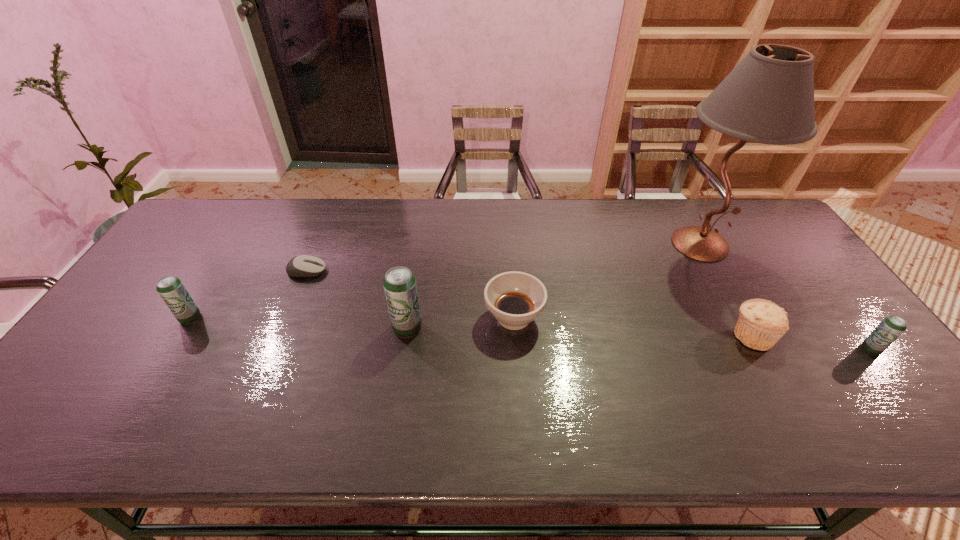
Identify which object is the third closest to the computer equipment. Please provide its 2D coordinates. Your answer should be formatted as a tuple, i.e. [(x, y)], where the tuple contains the x and y coordinates of a point satisfying the conditions above.

[(515, 299)]

Identify which beer can is the second nearest to the sixth shortest object. Please provide its 2D coordinates. Your answer should be formatted as a tuple, i.e. [(x, y)], where the tuple contains the x and y coordinates of a point satisfying the conditions above.

[(891, 327)]

Identify which beer can is the third closest to the muffin. Please provide its 2D coordinates. Your answer should be formatted as a tuple, i.e. [(x, y)], where the tuple contains the x and y coordinates of a point satisfying the conditions above.

[(170, 288)]

The height and width of the screenshot is (540, 960). I want to click on free space in the image that satisfies the following two spatial constraints: 1. on the wheel side of the shortest object; 2. on the right side of the rightmost beer can, so click(275, 349).

This screenshot has width=960, height=540. I want to click on free space that satisfies the following two spatial constraints: 1. on the back side of the tallest beer can; 2. on the right side of the soup bowl, so click(409, 318).

Locate an element on the screen. Image resolution: width=960 pixels, height=540 pixels. free location that satisfies the following two spatial constraints: 1. on the wheel side of the tallest beer can; 2. on the right side of the computer equipment is located at coordinates (283, 328).

Where is `free spot that satisfies the following two spatial constraints: 1. on the wheel side of the fourth object from right to left; 2. on the right side of the shortest object`? free spot that satisfies the following two spatial constraints: 1. on the wheel side of the fourth object from right to left; 2. on the right side of the shortest object is located at coordinates (288, 318).

Find the location of a particular element. The width and height of the screenshot is (960, 540). vacant area that satisfies the following two spatial constraints: 1. on the front-facing side of the table lamp; 2. on the front side of the fifth shortest object is located at coordinates (741, 318).